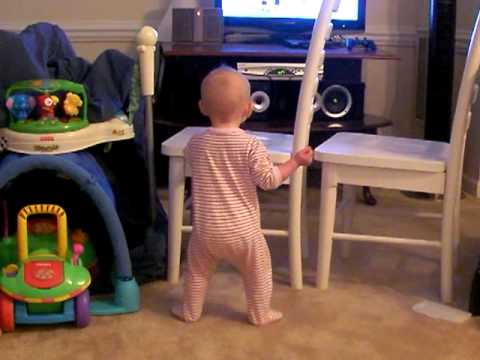
Image resolution: width=480 pixels, height=360 pixels. Identify the location of tv. (284, 10).